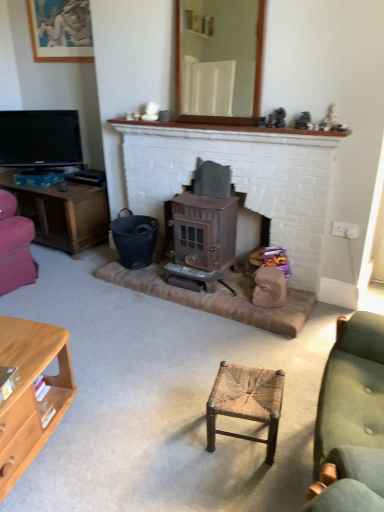
I want to click on blank space above woven wood stool at center (from a real-world perspective), so click(250, 379).